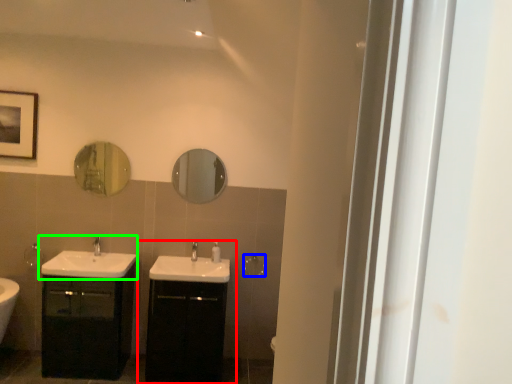
Question: Which object is positioned closest to bathroom cabinet (highlighted by a red box)? Select from towel bar (highlighted by a blue box) and sink (highlighted by a green box).

Choices:
 (A) towel bar
 (B) sink

Answer: (B)